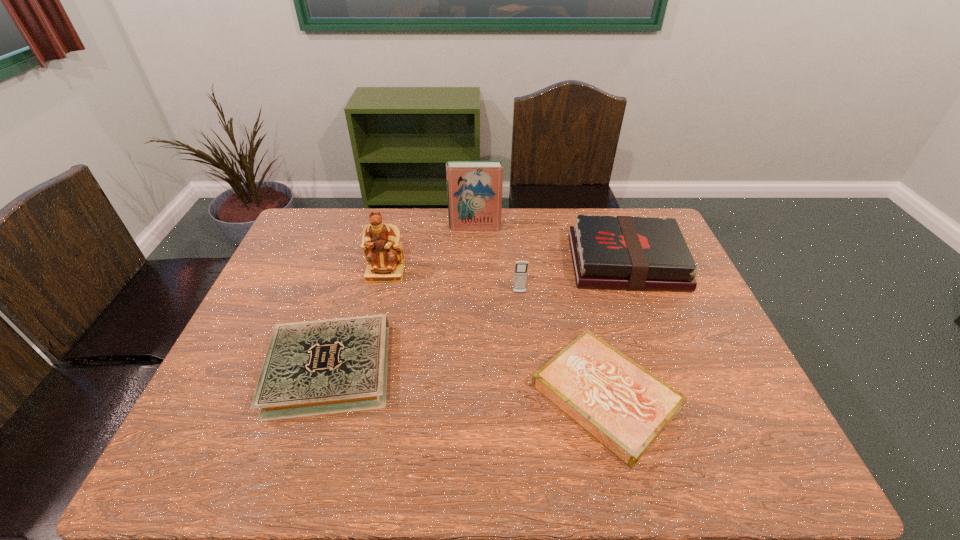
Identify the location of vacant space in between the second tallest hardback book and the shortest object. (615, 329).

Locate an element on the screen. vacant area that lies between the figurine and the cellular telephone is located at coordinates (452, 283).

Where is `vacant area between the cellular telephone and the shortest object`? The width and height of the screenshot is (960, 540). vacant area between the cellular telephone and the shortest object is located at coordinates (563, 345).

You are a GUI agent. You are given a task and a screenshot of the screen. Output one action in this format:
    pyautogui.click(x=<x>, y=<y>)
    Task: Click on the blank region between the cellular telephone and the figurine
    Image resolution: width=960 pixels, height=540 pixels.
    Given the screenshot: What is the action you would take?
    452,283

Point out which object is positioned as the third nearest to the shortest object. Please provide its 2D coordinates. Your answer should be formatted as a tuple, i.e. [(x, y)], where the tuple contains the x and y coordinates of a point satisfying the conditions above.

[(317, 367)]

Choose which object is the second nearest neighbor to the fourth object from right to left. Please provide its 2D coordinates. Your answer should be formatted as a tuple, i.e. [(x, y)], where the tuple contains the x and y coordinates of a point satisfying the conditions above.

[(630, 253)]

Locate an element on the screen. hardback book that stands as the closest to the farthest object is located at coordinates (630, 253).

Point out which hardback book is positioned as the second nearest to the third nearest hardback book. Please provide its 2D coordinates. Your answer should be formatted as a tuple, i.e. [(x, y)], where the tuple contains the x and y coordinates of a point satisfying the conditions above.

[(474, 188)]

Locate an element on the screen. Image resolution: width=960 pixels, height=540 pixels. vacant space that satisfies the following two spatial constraints: 1. on the front-facing side of the shortest object; 2. on the right side of the cellular telephone is located at coordinates (529, 396).

Locate an element on the screen. free space in the image that satisfies the following two spatial constraints: 1. on the front-facing side of the cellular telephone; 2. on the right side of the shortest hardback book is located at coordinates (529, 396).